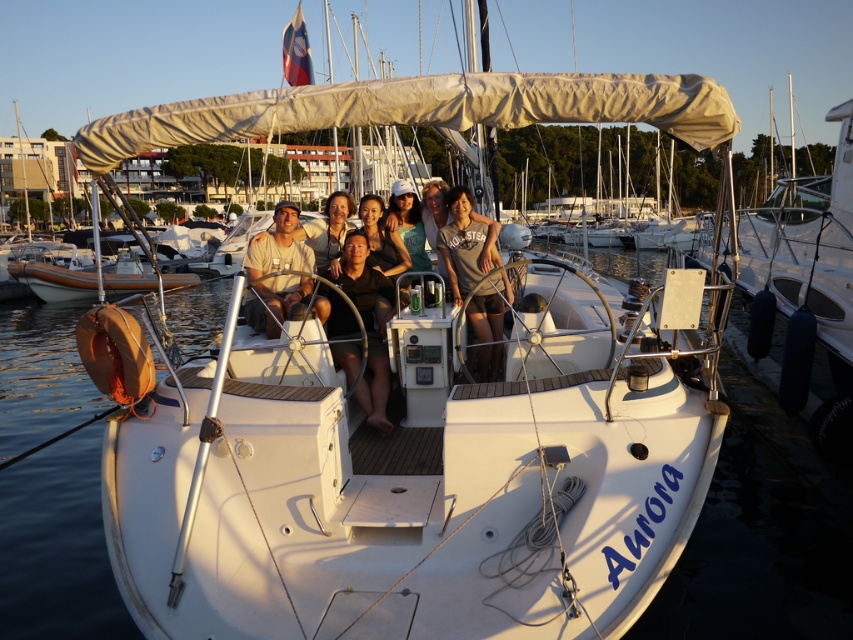
Between white matte boat at right and black matte shirt at center, which one has less height?

black matte shirt at center

Does white matte boat at right have a greater height compared to black matte shirt at center?

Correct, white matte boat at right is much taller as black matte shirt at center.

What do you see at coordinates (807, 246) in the screenshot?
I see `white matte boat at right` at bounding box center [807, 246].

What are the coordinates of `white matte boat at right` in the screenshot? It's located at (807, 246).

Does white matte boat at right have a larger size compared to gray cotton shirt at center?

Yes.

Does white matte boat at right have a greater width compared to gray cotton shirt at center?

Indeed, white matte boat at right has a greater width compared to gray cotton shirt at center.

Where is `white matte boat at right`? white matte boat at right is located at coordinates (807, 246).

Find the location of a particular element. This screenshot has height=640, width=853. white matte boat at right is located at coordinates (807, 246).

From the picture: Which is more to the left, matte beige shirt at center or white matte boat at left?

Positioned to the left is white matte boat at left.

Does matte beige shirt at center have a larger size compared to white matte boat at left?

No.

This screenshot has height=640, width=853. I want to click on matte beige shirt at center, so click(x=279, y=246).

Locate an element on the screen. Image resolution: width=853 pixels, height=640 pixels. matte beige shirt at center is located at coordinates (279, 246).